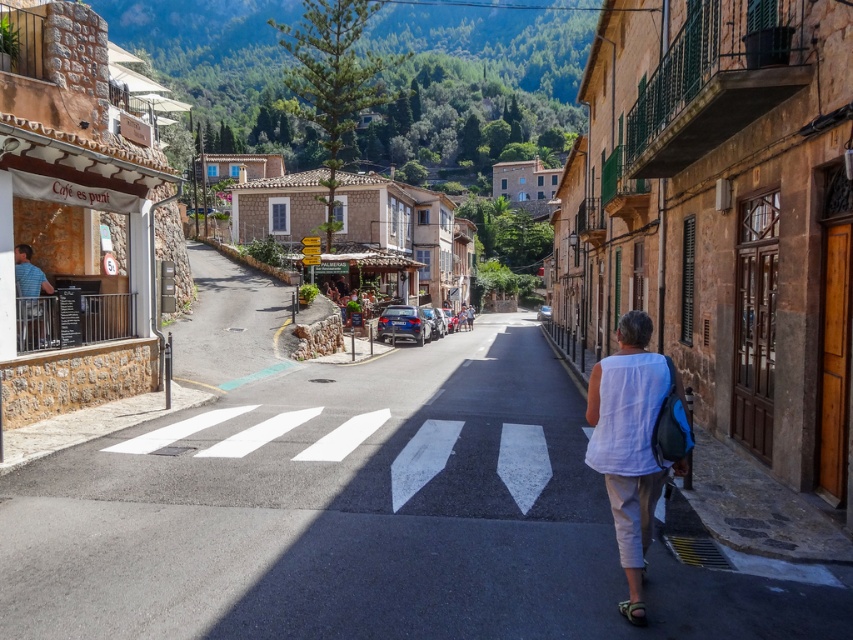
Is asphalt road at center to the right of white cotton shirt at lower right from the viewer's perspective?

No, asphalt road at center is not to the right of white cotton shirt at lower right.

Which is behind, point (444, 634) or point (637, 596)?

Positioned behind is point (637, 596).

Find the location of a particular element. asphalt road at center is located at coordinates (370, 516).